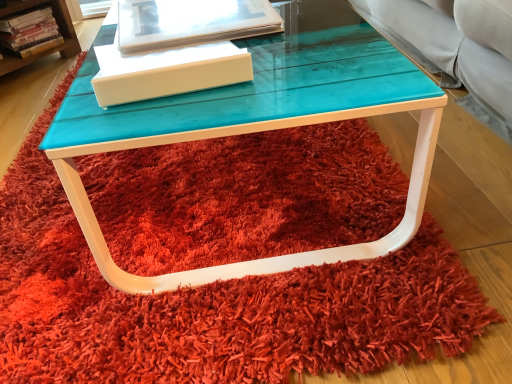
Question: Is translucent plastic book at upper center, the second book viewed from the top, outside of turquoise glossy table at center?

Choices:
 (A) no
 (B) yes

Answer: (B)

Question: Is translucent plastic book at upper center, placed as the first book when sorted from front to back, looking in the opposite direction of turquoise glossy table at center?

Choices:
 (A) yes
 (B) no

Answer: (B)

Question: Can you confirm if translucent plastic book at upper center, acting as the second book starting from the back, is bigger than turquoise glossy table at center?

Choices:
 (A) yes
 (B) no

Answer: (B)

Question: Is translucent plastic book at upper center, placed as the first book when sorted from front to back, to the left of turquoise glossy table at center from the viewer's perspective?

Choices:
 (A) yes
 (B) no

Answer: (A)

Question: Could you tell me if translucent plastic book at upper center, which appears as the 2th book when viewed from the left, is facing turquoise glossy table at center?

Choices:
 (A) yes
 (B) no

Answer: (B)

Question: In the image, is white matte box at center on the left side or the right side of hardcover book at left, the second book positioned from the bottom?

Choices:
 (A) left
 (B) right

Answer: (B)

Question: From a real-world perspective, is white matte box at center above or below hardcover book at left, placed as the 1th book when sorted from top to bottom?

Choices:
 (A) above
 (B) below

Answer: (A)

Question: Relative to hardcover book at left, the 2th book when ordered from right to left, is white matte box at center in front or behind?

Choices:
 (A) front
 (B) behind

Answer: (A)

Question: Would you say white matte box at center is inside or outside hardcover book at left, positioned as the first book in back-to-front order?

Choices:
 (A) inside
 (B) outside

Answer: (B)

Question: Considering the positions of point (238, 24) and point (20, 36), is point (238, 24) closer or farther from the camera than point (20, 36)?

Choices:
 (A) closer
 (B) farther

Answer: (A)

Question: Visually, is translucent plastic book at upper center, the second book viewed from the top, positioned to the left or to the right of hardcover book at left, positioned as the first book in back-to-front order?

Choices:
 (A) right
 (B) left

Answer: (A)

Question: From a real-world perspective, is translucent plastic book at upper center, arranged as the 1th book when viewed from the right, physically located above or below hardcover book at left, which appears as the first book when viewed from the left?

Choices:
 (A) above
 (B) below

Answer: (A)

Question: In terms of width, does translucent plastic book at upper center, which appears as the 2th book when viewed from the left, look wider or thinner when compared to hardcover book at left, the second book positioned from the bottom?

Choices:
 (A) thin
 (B) wide

Answer: (B)

Question: From a real-world perspective, is translucent plastic book at upper center, the first book from the bottom, physically located above or below white matte box at center?

Choices:
 (A) below
 (B) above

Answer: (A)

Question: Considering the positions of translucent plastic book at upper center, the first book from the bottom, and white matte box at center in the image, is translucent plastic book at upper center, the first book from the bottom, bigger or smaller than white matte box at center?

Choices:
 (A) small
 (B) big

Answer: (B)